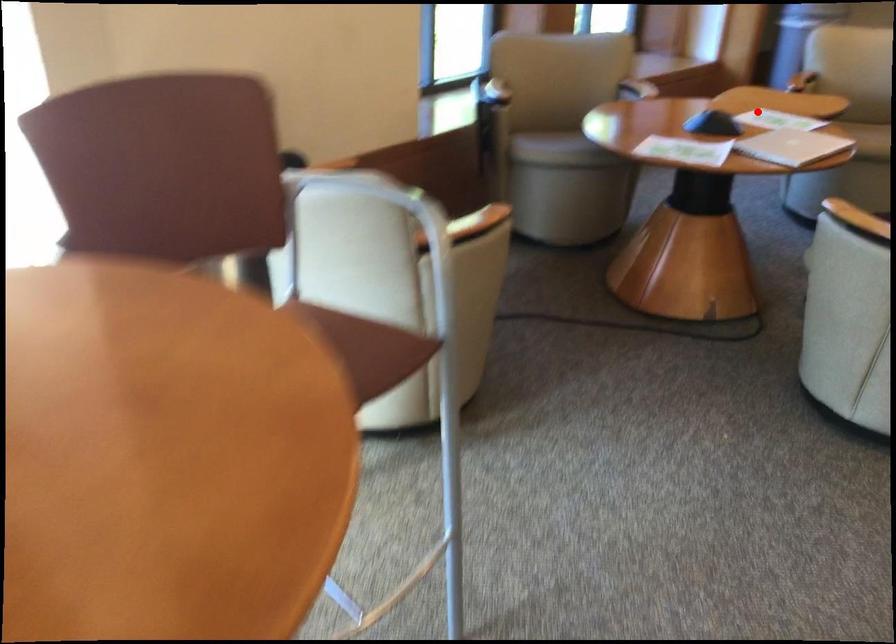
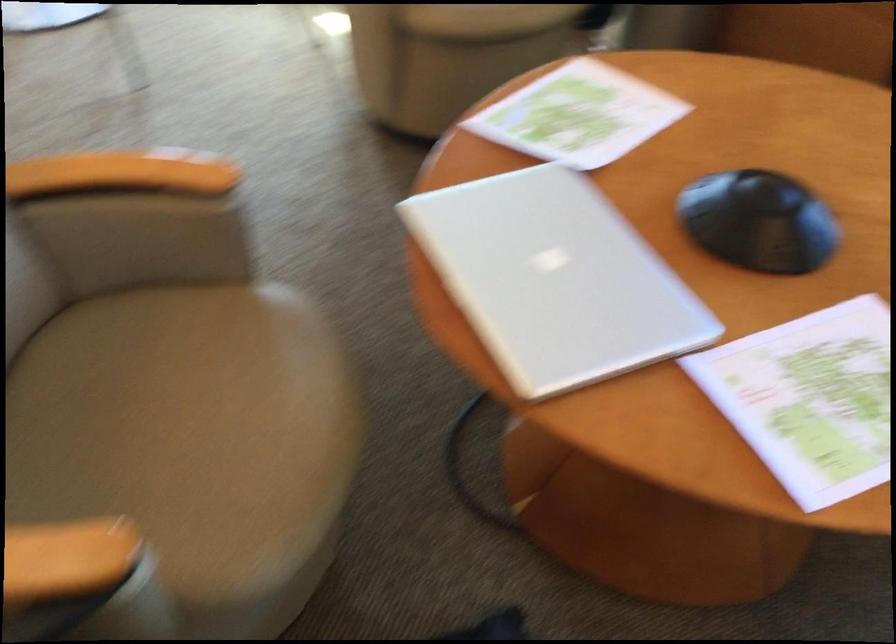
Question: I am providing you with two images of the same scene from different viewpoints. In image1, a red point is highlighted. Considering the same 3D point in image2, which of the following is correct?

Choices:
 (A) It is closer
 (B) It is farther

Answer: (A)